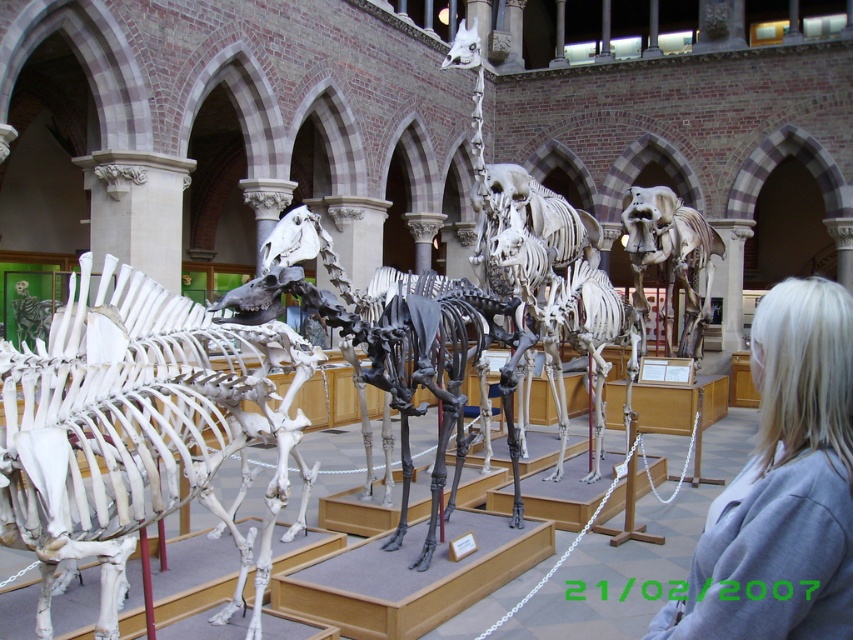
Which is more to the left, white bone at center or blonde hair at center?

From the viewer's perspective, white bone at center appears more on the left side.

Between point (42, 396) and point (767, 576), which one is positioned behind?

The point (42, 396) is more distant.

Find the location of `white bone at center`. white bone at center is located at coordinates (132, 426).

Does blonde hair at center have a greater height compared to white bone elephant at center?

No, blonde hair at center is not taller than white bone elephant at center.

What do you see at coordinates (782, 486) in the screenshot? The height and width of the screenshot is (640, 853). I see `blonde hair at center` at bounding box center [782, 486].

What are the coordinates of `blonde hair at center` in the screenshot? It's located at (782, 486).

Where is `blonde hair at center`? blonde hair at center is located at coordinates (782, 486).

Measure the distance from white bone at center to white bone elephant at center.

They are 20.62 meters apart.

Is white bone at center shorter than white bone elephant at center?

Yes.

Where is `white bone at center`? The height and width of the screenshot is (640, 853). white bone at center is located at coordinates (132, 426).

This screenshot has height=640, width=853. I want to click on white bone at center, so click(132, 426).